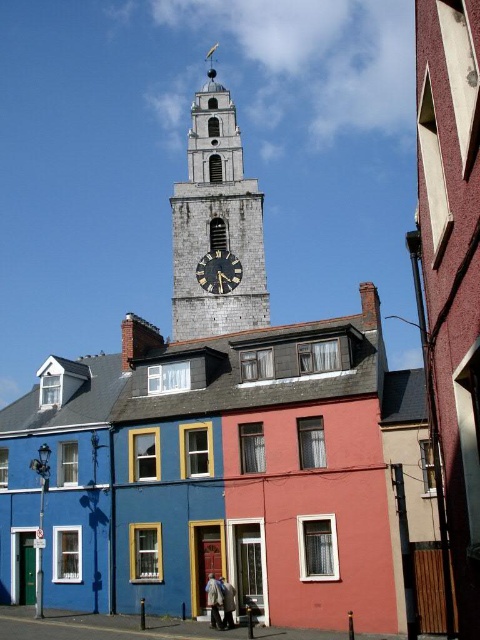
You are a city planner reviewing the urban layout. You need to determine which structure is taller between the silver metallic clock tower at upper center and the black polished clock at center. Based on the scene, which one is taller?

The silver metallic clock tower at upper center is taller than the black polished clock at center.

You are a tourist standing in the square and want to take a photo of the silver metallic clock tower at upper center and the black polished clock at center. Which one should you point your camera upwards to capture?

You should point your camera upwards to capture the silver metallic clock tower at upper center because it is located above the black polished clock at center.

You are standing in the middle of the street looking at the silver metallic clock tower at upper center and the black polished clock at center. Which object is closer to you?

The silver metallic clock tower at upper center is closer to you since it is in front of the black polished clock at center.